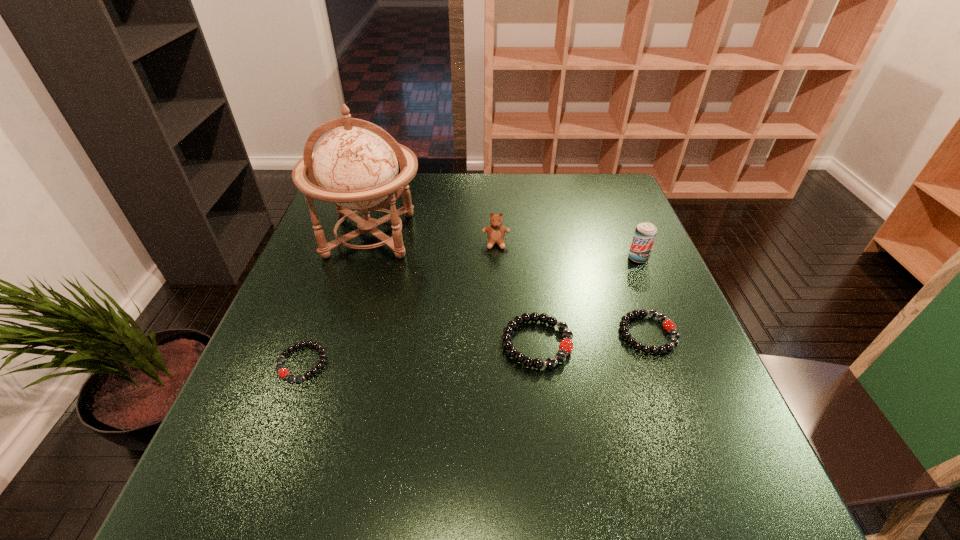
This screenshot has width=960, height=540. In order to click on vacant space that satisfies the following two spatial constraints: 1. on the back side of the rightmost bracelet; 2. on the right side of the shortest bracelet in this screenshot , I will do `click(313, 334)`.

I want to click on free location that satisfies the following two spatial constraints: 1. on the front-facing side of the teddy bear; 2. on the right side of the tallest bracelet, so click(500, 343).